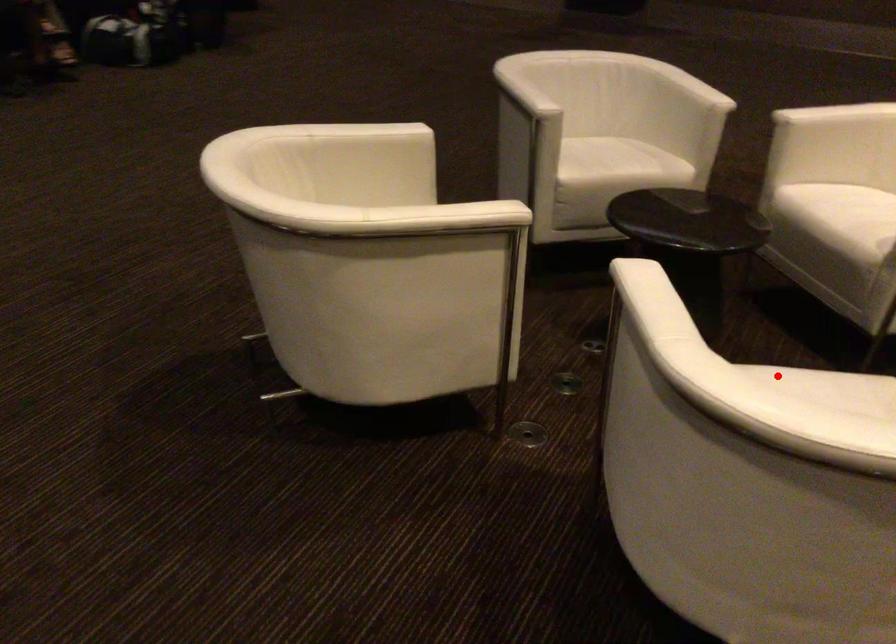
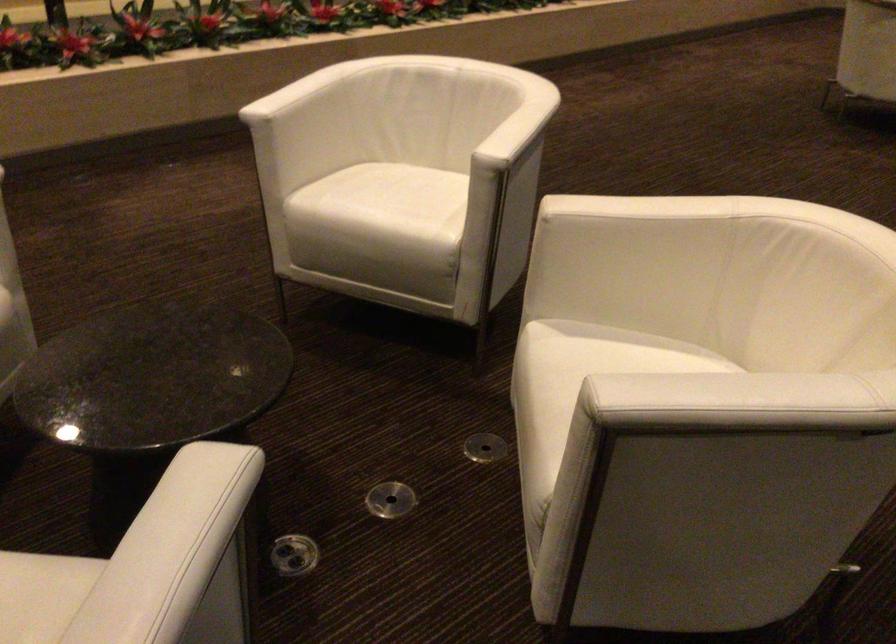
Question: A red point is marked in image1. In image2, is the corresponding 3D point closer to the camera or farther? Reply with the corresponding letter.

Choices:
 (A) The corresponding 3D point is closer.
 (B) The corresponding 3D point is farther.

Answer: (B)